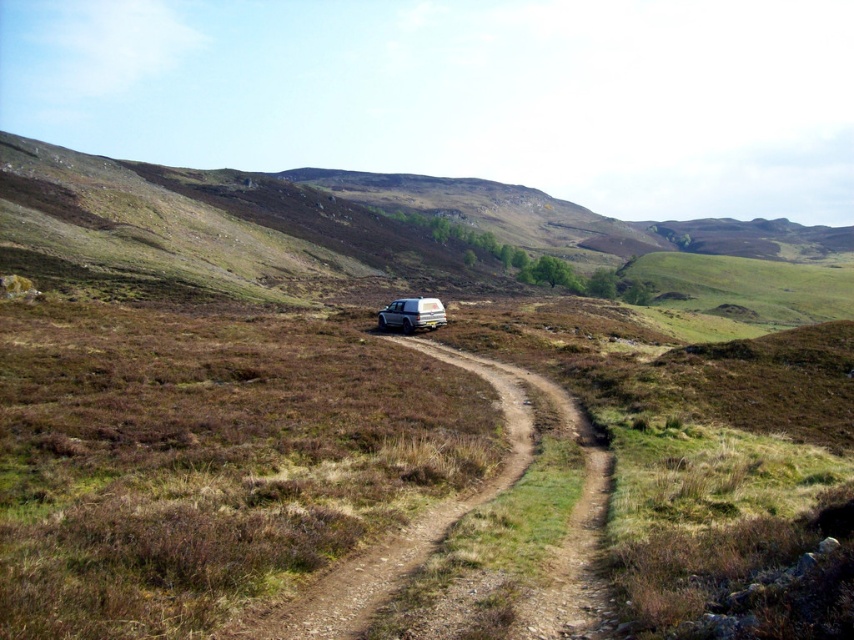
Question: Which point is closer to the camera taking this photo?

Choices:
 (A) (440, 301)
 (B) (571, 584)

Answer: (B)

Question: Which object is farther from the camera taking this photo?

Choices:
 (A) brown dirt trail at center
 (B) silver metallic jeep at center

Answer: (B)

Question: Can you confirm if brown dirt trail at center is positioned to the right of silver metallic jeep at center?

Choices:
 (A) no
 (B) yes

Answer: (B)

Question: Is brown dirt trail at center above silver metallic jeep at center?

Choices:
 (A) no
 (B) yes

Answer: (A)

Question: Is brown dirt trail at center positioned in front of silver metallic jeep at center?

Choices:
 (A) no
 (B) yes

Answer: (B)